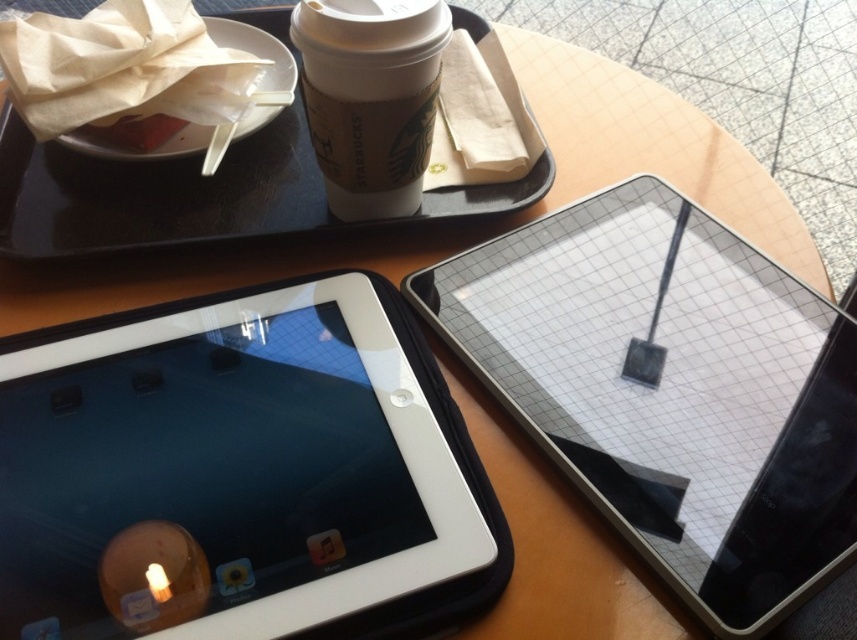
Can you confirm if black glossy tablet at center is positioned to the left of black plastic tray at upper center?

No, black glossy tablet at center is not to the left of black plastic tray at upper center.

Is black glossy tablet at center smaller than black plastic tray at upper center?

Correct, black glossy tablet at center occupies less space than black plastic tray at upper center.

What do you see at coordinates (670, 392) in the screenshot? The image size is (857, 640). I see `black glossy tablet at center` at bounding box center [670, 392].

Locate an element on the screen. The image size is (857, 640). black glossy tablet at center is located at coordinates (670, 392).

Is white glossy tablet at center to the left of black plastic tray at upper center from the viewer's perspective?

In fact, white glossy tablet at center is to the right of black plastic tray at upper center.

Does white glossy tablet at center have a smaller size compared to black plastic tray at upper center?

Yes.

Who is more forward, (108, 529) or (274, 205)?

Point (108, 529) is more forward.

You are a GUI agent. You are given a task and a screenshot of the screen. Output one action in this format:
    pyautogui.click(x=<x>, y=<y>)
    Task: Click on the white glossy tablet at center
    The image size is (857, 640).
    Given the screenshot: What is the action you would take?
    pyautogui.click(x=238, y=472)

Can you confirm if white glossy tablet at center is positioned above white paper cup at upper center?

No.

Does point (405, 428) lie behind point (361, 177)?

That is False.

This screenshot has height=640, width=857. Identify the location of white glossy tablet at center. (238, 472).

Where is `white glossy tablet at center`? white glossy tablet at center is located at coordinates (238, 472).